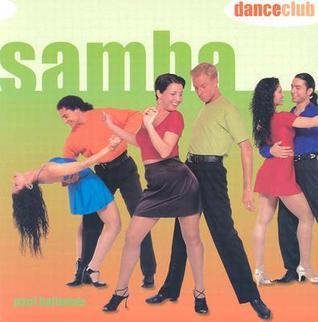
Locate an element on the screen. The image size is (318, 322). album is located at coordinates click(149, 99).